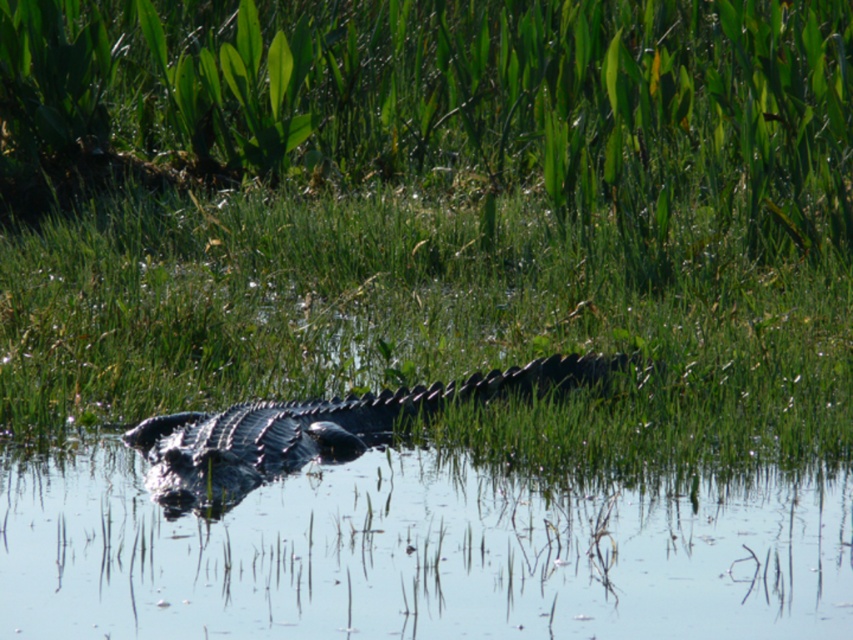
Does green rough grass at center appear on the right side of clear water at center?

No, green rough grass at center is not to the right of clear water at center.

Which is more to the right, green rough grass at center or clear water at center?

From the viewer's perspective, clear water at center appears more on the right side.

Is point (804, 337) closer to viewer compared to point (799, 624)?

No, (804, 337) is behind (799, 624).

This screenshot has height=640, width=853. I want to click on green rough grass at center, so click(440, 216).

Does point (343, 593) lie in front of point (294, 456)?

Yes, point (343, 593) is in front of point (294, 456).

Between point (370, 481) and point (386, 428), which one is positioned behind?

Point (386, 428)

This screenshot has height=640, width=853. I want to click on clear water at center, so click(421, 554).

Does point (769, 328) come farther from viewer compared to point (247, 433)?

Yes, point (769, 328) is farther from viewer.

Who is more distant from viewer, (71, 304) or (169, 445)?

The point (71, 304) is behind.

Locate an element on the screen. The image size is (853, 640). green rough grass at center is located at coordinates (440, 216).